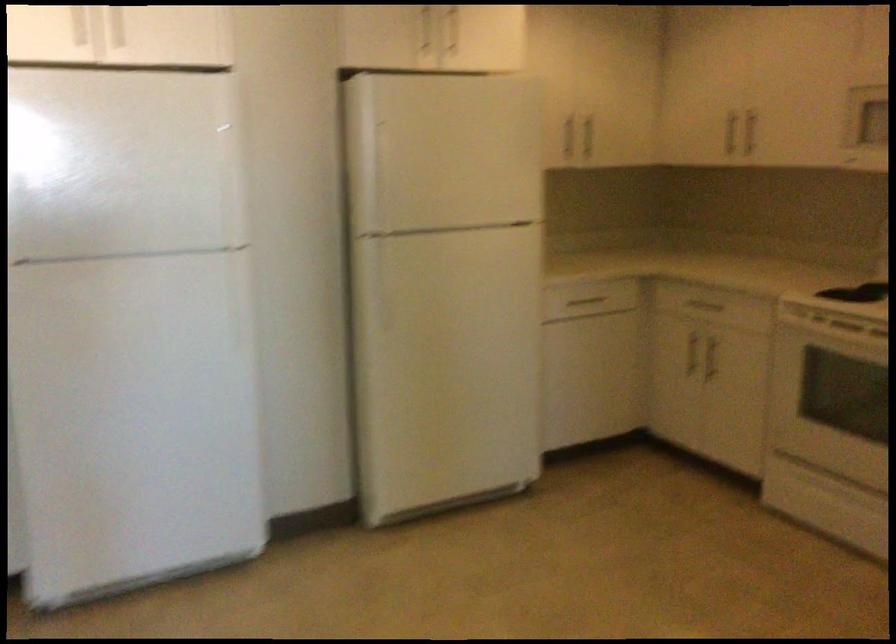
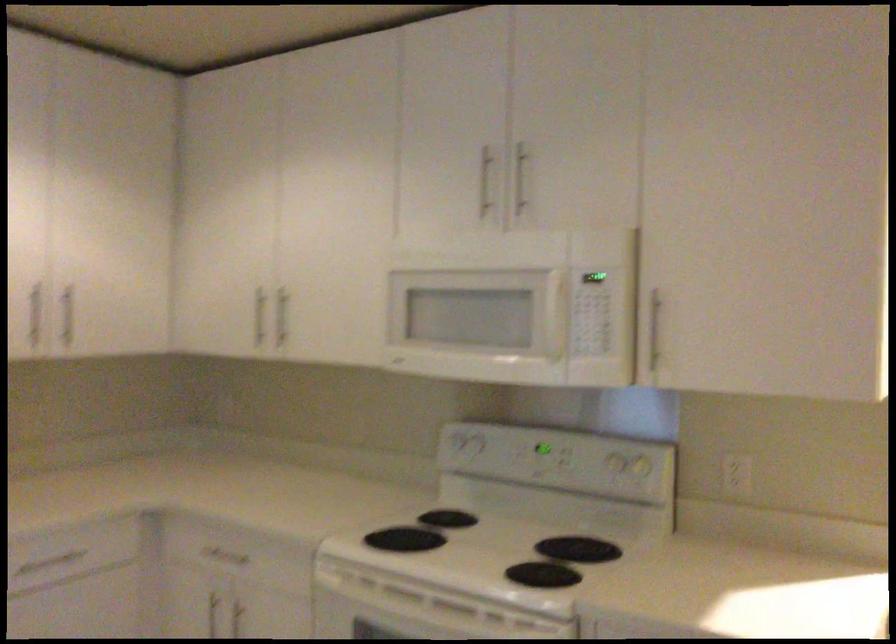
In the second image, find the point that corresponds to point (583, 136) in the first image.

(66, 316)